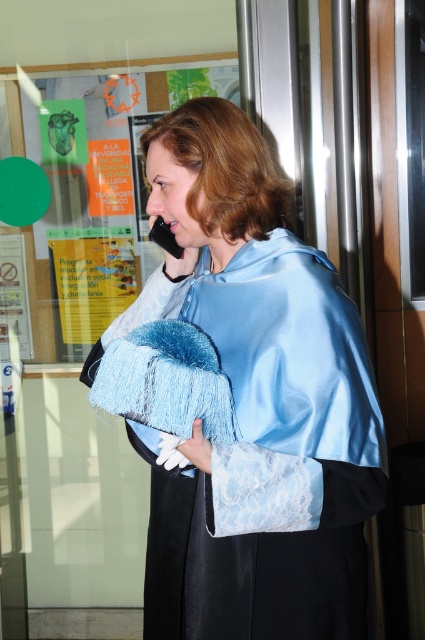
Question: Can you confirm if satin blue cape at center is positioned to the right of green paper at upper left?

Choices:
 (A) yes
 (B) no

Answer: (A)

Question: Can you confirm if satin blue cape at center is smaller than green paper at upper left?

Choices:
 (A) no
 (B) yes

Answer: (A)

Question: Among these points, which one is farthest from the camera?

Choices:
 (A) (229, 179)
 (B) (112, 246)

Answer: (B)

Question: Does satin blue cape at center have a larger size compared to green paper at upper left?

Choices:
 (A) yes
 (B) no

Answer: (A)